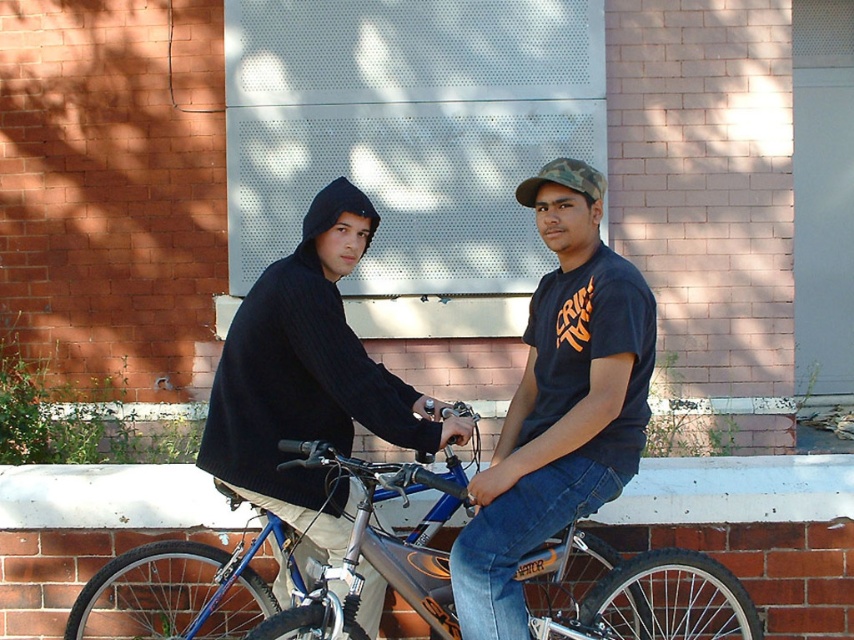
You are trying to determine if the blue metallic bicycle at center can fit through a doorway that is the same height as the dark blue knit hoodie at left. Can it pass through?

The blue metallic bicycle at center is not as tall as the dark blue knit hoodie at left, so it can pass through the doorway since it is shorter in height.